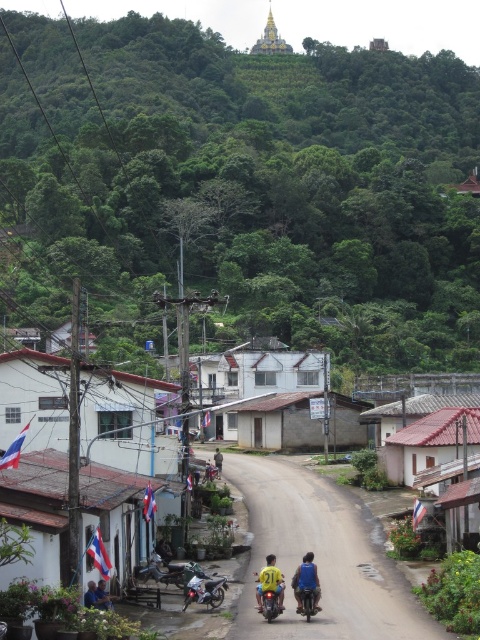
You are a photographer standing at the edge of the dirt road in the rural village scene. You notice the yellow matte motorcycle at center and the yellow shirt at center. Which object appears larger in the image?

The yellow shirt at center appears larger than the yellow matte motorcycle at center because the motorcycle is smaller in size compared to the shirt.

You are a visitor in this village and you see the yellow matte motorcycle at center and the yellow shirt at center. Which one is higher up in the image?

The yellow matte motorcycle at center is located above the yellow shirt at center in the image.

You are a delivery person who needs to park both the silver metallic motorcycle at center and the yellow matte motorcycle at center along the dirt road. The road is 2 meters wide. Can both motorcycles fit side by side on the road without overlapping?

The silver metallic motorcycle at center is wider than the yellow matte motorcycle at center. Since the road is 2 meters wide, the combined width of both motorcycles must be less than or equal to 2 meters. However, without knowing the exact widths of each motorcycle, it is impossible to determine if they can fit side by side. Please provide the exact measurements of both motorcycles to calculate the total width required.